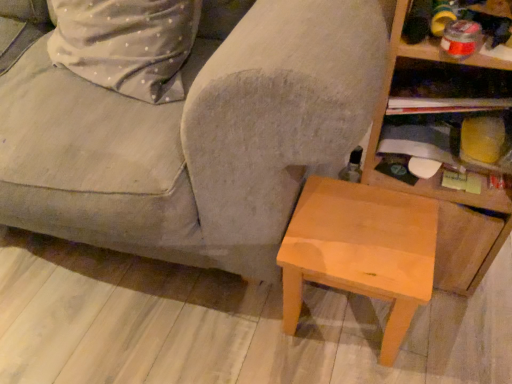
What are the coordinates of `blank space above light brown wood stool at lower right (from a real-world perspective)` in the screenshot? It's located at (366, 227).